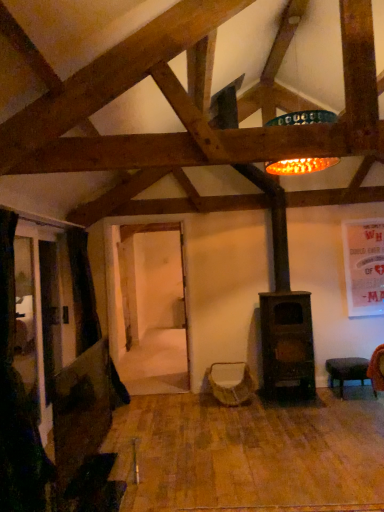
Question: From a real-world perspective, is woven fabric swivel chair at center physically located above or below black fabric curtain at left?

Choices:
 (A) below
 (B) above

Answer: (A)

Question: Is woven fabric swivel chair at center taller or shorter than black fabric curtain at left?

Choices:
 (A) tall
 (B) short

Answer: (B)

Question: Which object is the farthest from the black fabric curtain at left?

Choices:
 (A) black leather stool at lower right
 (B) woven fabric swivel chair at center

Answer: (A)

Question: Estimate the real-world distances between objects in this image. Which object is farther from the woven fabric swivel chair at center?

Choices:
 (A) black fabric curtain at left
 (B) black leather stool at lower right

Answer: (A)